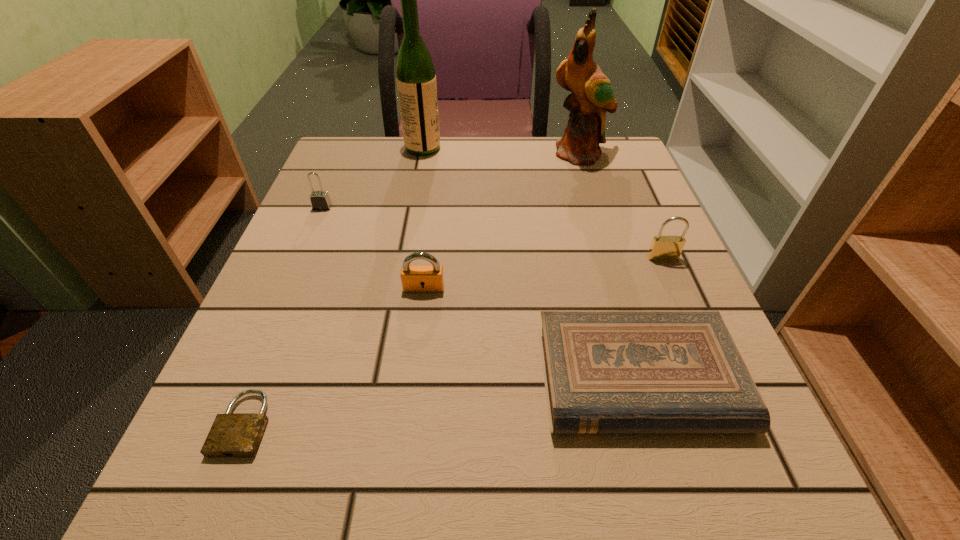
The height and width of the screenshot is (540, 960). Find the location of `vacant region located on the label of the liquor`. vacant region located on the label of the liquor is located at coordinates point(571,148).

Find the location of a particular element. The width and height of the screenshot is (960, 540). vacant space located 0.180m on the front-facing side of the parrot is located at coordinates pyautogui.click(x=598, y=214).

Where is `vacant space located on the front-facing side of the fourth nearest object`? vacant space located on the front-facing side of the fourth nearest object is located at coordinates (720, 390).

At what (x,y) coordinates should I click in order to perform the action: click on vacant space located 0.340m on the shackle of the third farthest object. Please return your answer as a coordinate pair (x, y). The width and height of the screenshot is (960, 540). Looking at the image, I should click on (266, 342).

The width and height of the screenshot is (960, 540). I want to click on free space located 0.160m to unlock the second padlock from right to left from the front, so pyautogui.click(x=414, y=372).

Find the location of a particular element. The image size is (960, 540). blank space located 0.060m on the spine side of the sixth tallest object is located at coordinates (670, 487).

Where is `liquor present at the far edge`? The width and height of the screenshot is (960, 540). liquor present at the far edge is located at coordinates (415, 73).

Image resolution: width=960 pixels, height=540 pixels. In order to click on parrot located at the far edge in this screenshot , I will do `click(592, 95)`.

Find the location of a particular element. object located at the near edge is located at coordinates (232, 434).

Where is `parrot located at the right edge`? This screenshot has height=540, width=960. parrot located at the right edge is located at coordinates (592, 95).